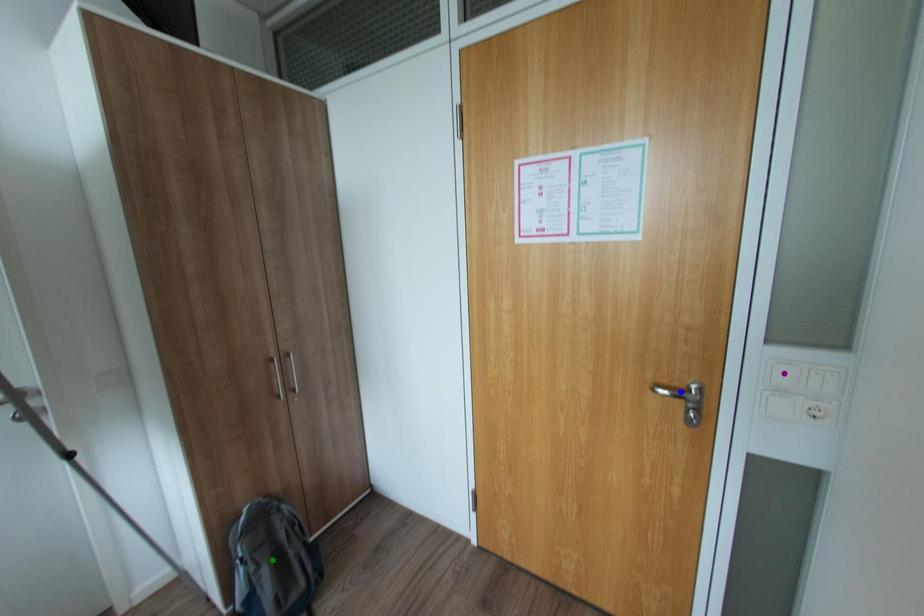
Order these from nearest to farthest:
purple point
blue point
green point

purple point
blue point
green point